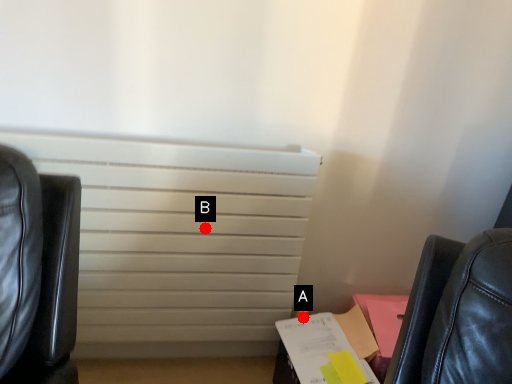
Question: Two points are circled on the image, labeled by A and B beside each circle. Which point is farther from the camera taking this photo?

Choices:
 (A) A is further
 (B) B is further

Answer: (A)